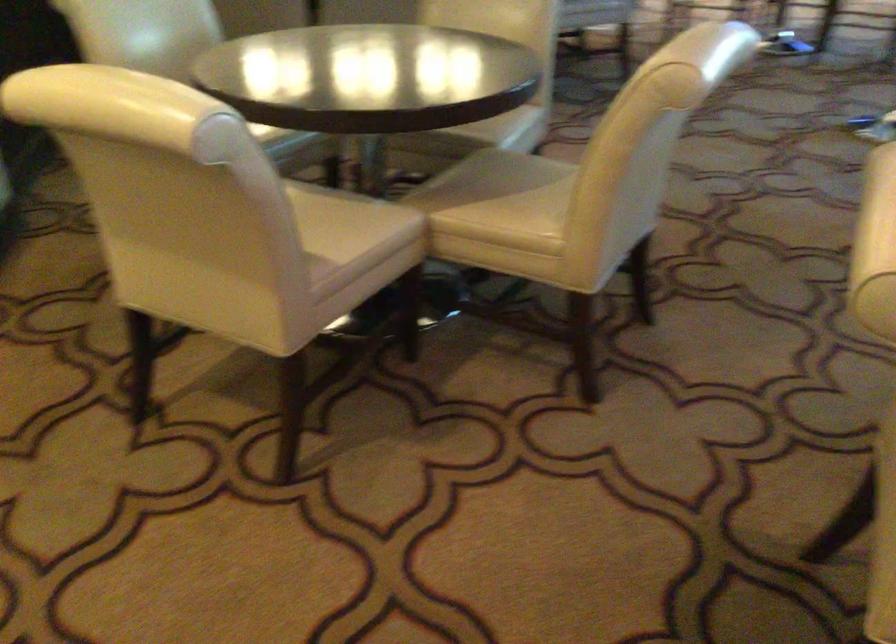
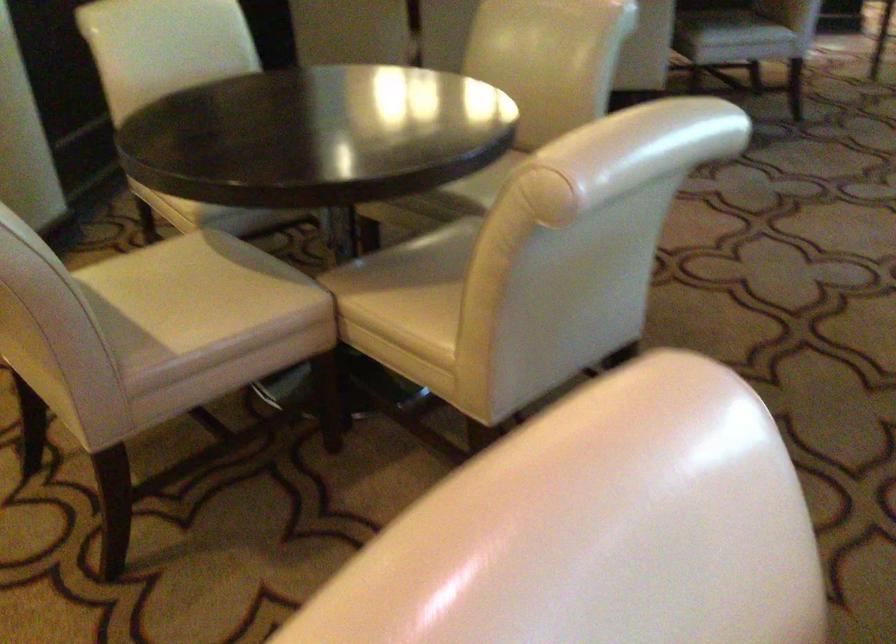
Question: The camera is either moving clockwise (left) or counter-clockwise (right) around the object. The first image is from the beginning of the video and the second image is from the end. Is the camera moving left or right when shooting the video?

Choices:
 (A) Left
 (B) Right

Answer: (B)